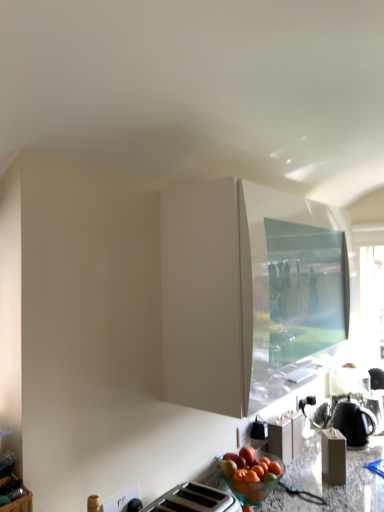
Question: Considering the positions of black matte kettle at lower right and white glossy cabinet at upper center in the image, is black matte kettle at lower right bigger or smaller than white glossy cabinet at upper center?

Choices:
 (A) small
 (B) big

Answer: (A)

Question: Visually, is black matte kettle at lower right positioned to the left or to the right of white glossy cabinet at upper center?

Choices:
 (A) right
 (B) left

Answer: (A)

Question: Considering the positions of black matte kettle at lower right and white glossy cabinet at upper center in the image, is black matte kettle at lower right wider or thinner than white glossy cabinet at upper center?

Choices:
 (A) thin
 (B) wide

Answer: (A)

Question: Is point (213, 207) positioned closer to the camera than point (349, 397)?

Choices:
 (A) closer
 (B) farther

Answer: (A)

Question: Is white glossy cabinet at upper center in front of or behind black matte kettle at lower right in the image?

Choices:
 (A) behind
 (B) front

Answer: (B)

Question: Considering the positions of white glossy cabinet at upper center and black matte kettle at lower right in the image, is white glossy cabinet at upper center taller or shorter than black matte kettle at lower right?

Choices:
 (A) tall
 (B) short

Answer: (A)

Question: From the image's perspective, is white glossy cabinet at upper center located above or below black matte kettle at lower right?

Choices:
 (A) below
 (B) above

Answer: (B)